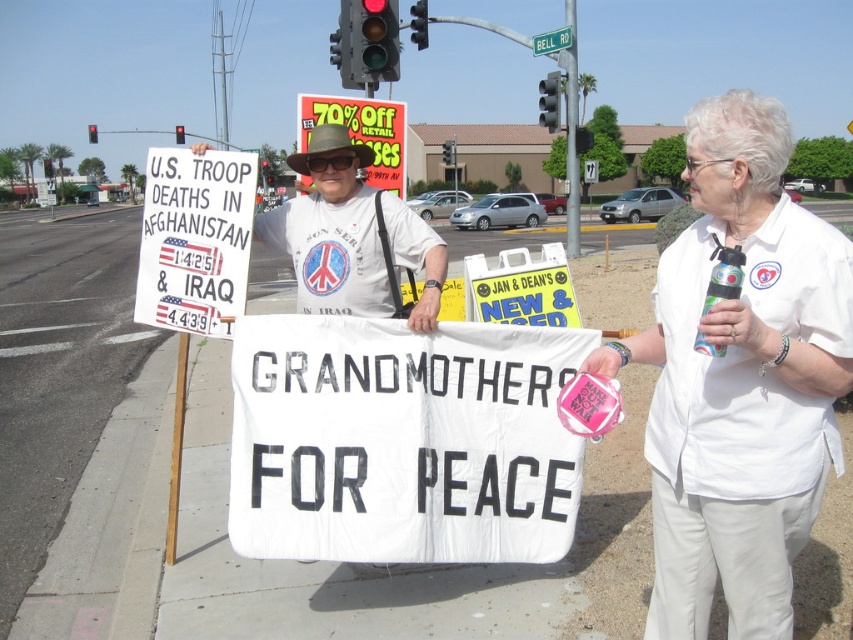
Does white t-shirt with peace symbol at center appear over white plastic street sign at upper center?

Incorrect, white t-shirt with peace symbol at center is not positioned above white plastic street sign at upper center.

Is point (381, 269) farther from viewer compared to point (572, 29)?

No, (381, 269) is in front of (572, 29).

Between point (318, 209) and point (547, 52), which one is positioned behind?

The point (547, 52) is more distant.

At what (x,y) coordinates should I click in order to perform the action: click on white t-shirt with peace symbol at center. Please return your answer as a coordinate pair (x, y). This screenshot has height=640, width=853. Looking at the image, I should click on (351, 236).

In order to click on white fabric shirt at center in this screenshot , I will do `click(740, 380)`.

The height and width of the screenshot is (640, 853). Find the location of `white fabric shirt at center`. white fabric shirt at center is located at coordinates (740, 380).

Does point (779, 564) lie behind point (305, 230)?

No, (779, 564) is in front of (305, 230).

The width and height of the screenshot is (853, 640). What do you see at coordinates (740, 380) in the screenshot?
I see `white fabric banner at center` at bounding box center [740, 380].

From the picture: Who is more distant from viewer, (741, 388) or (329, 260)?

The point (329, 260) is behind.

This screenshot has width=853, height=640. What are the coordinates of `white fabric banner at center` in the screenshot? It's located at (740, 380).